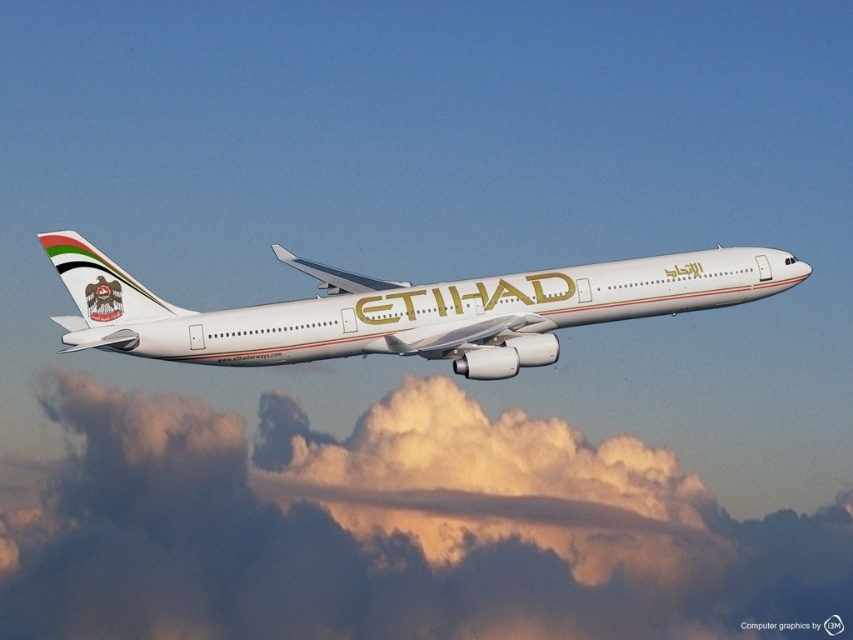
You are a pilot flying an ETIHAD airplane and want to avoid turbulence caused by a nearby cloud. The white fluffy cloud at upper center is in your flight path. Can you safely maneuver around it if your plane can avoid obstacles within a 200 meter radius?

The white fluffy cloud at upper center is 159.17 meters away from the viewer. Since the plane can avoid obstacles within a 200 meter radius, it can safely maneuver around the cloud as the distance is within the safe range.

You are a pilot flying the white glossy airplane at center. You notice a white fluffy cloud at upper center. Can you determine if the cloud is wider than your airplane?

The white fluffy cloud at upper center is wider than the white glossy airplane at center, so yes, the cloud is wider than the airplane.

Based on the photo, you are a passenger looking out the window of the white glossy airplane at center. You notice a white fluffy cloud at upper center. In which direction relative to your current position is the cloud located?

The white fluffy cloud at upper center is to the right of the white glossy airplane at center, so the cloud is located to the right side of the airplane.